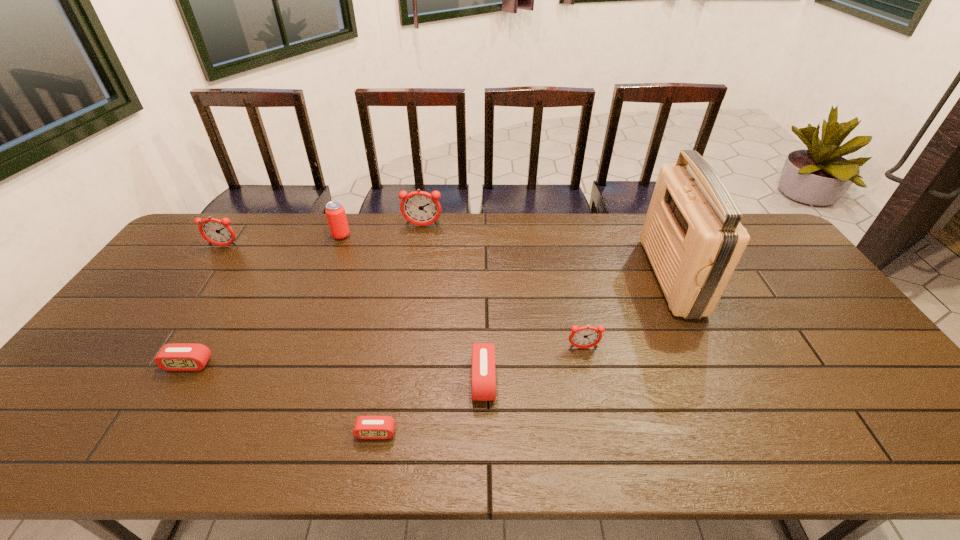
Locate an element on the screen. This screenshot has height=540, width=960. free spot between the tallest object and the sixth object from right to left is located at coordinates (506, 256).

Where is `free spot between the radio receiver and the rightmost reddish-pink alarm clock`? The height and width of the screenshot is (540, 960). free spot between the radio receiver and the rightmost reddish-pink alarm clock is located at coordinates pos(627,312).

What are the coordinates of `vacant region between the second farthest reddish-pink alarm clock and the nearest object` in the screenshot? It's located at click(x=300, y=340).

At what (x,y) coordinates should I click in order to perform the action: click on vacant space in between the second alarm clock from left to right and the fifth nearest alarm clock. Please return your answer as a coordinate pair (x, y). Image resolution: width=960 pixels, height=540 pixels. Looking at the image, I should click on (206, 305).

Where is `free area in between the nearest reddish-pink alarm clock and the second smallest reddish-pink alarm clock`? This screenshot has width=960, height=540. free area in between the nearest reddish-pink alarm clock and the second smallest reddish-pink alarm clock is located at coordinates 403,297.

What are the coordinates of `vacant space in between the beige radio receiver and the farthest reddish-pink alarm clock` in the screenshot? It's located at (547, 251).

You are a GUI agent. You are given a task and a screenshot of the screen. Output one action in this format:
    pyautogui.click(x=<x>, y=<y>)
    Task: Click on the free spot between the seventh object from left to right and the farthest reddish-pink alarm clock
    This screenshot has height=540, width=960.
    Given the screenshot: What is the action you would take?
    pyautogui.click(x=503, y=287)

This screenshot has height=540, width=960. I want to click on the fourth closest object to the leftmost reddish-pink alarm clock, so click(x=366, y=427).

This screenshot has width=960, height=540. Find the location of `the closest object to the second smallest reddish-pink alarm clock`. the closest object to the second smallest reddish-pink alarm clock is located at coordinates (335, 212).

Identify which alarm clock is located as the nearest to the beige radio receiver. Please provide its 2D coordinates. Your answer should be formatted as a tuple, i.e. [(x, y)], where the tuple contains the x and y coordinates of a point satisfying the conditions above.

[(583, 337)]